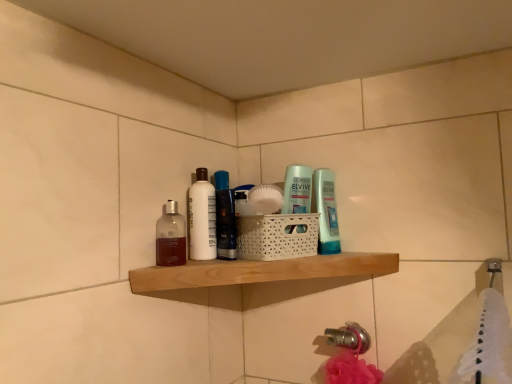
Locate an element on the screen. vacant area that lies between translucent glass mouthwash at shelf center, acting as the 1th mouthwash starting from the left, and translucent plastic bottle at center, marked as the 2th toiletry in a left-to-right arrangement is located at coordinates (250, 260).